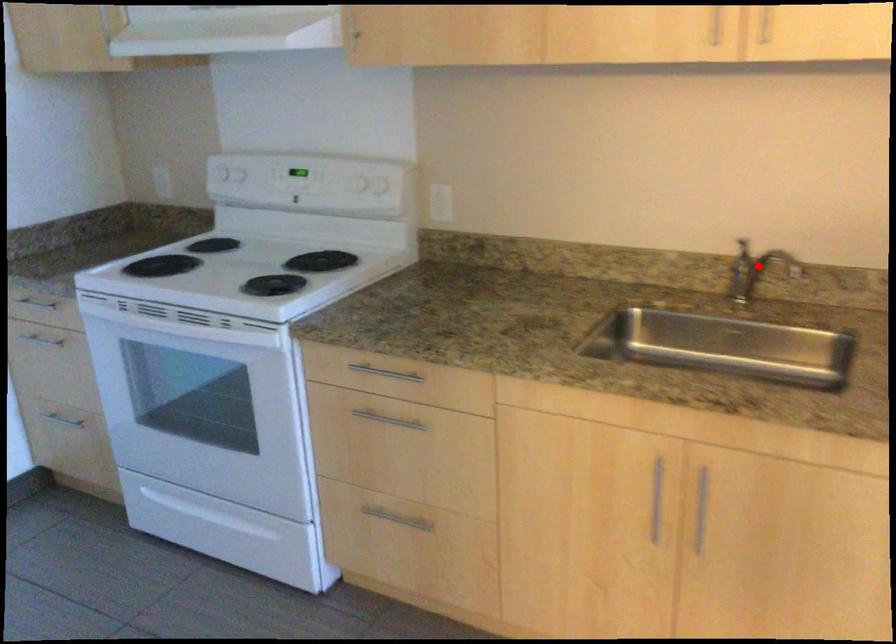
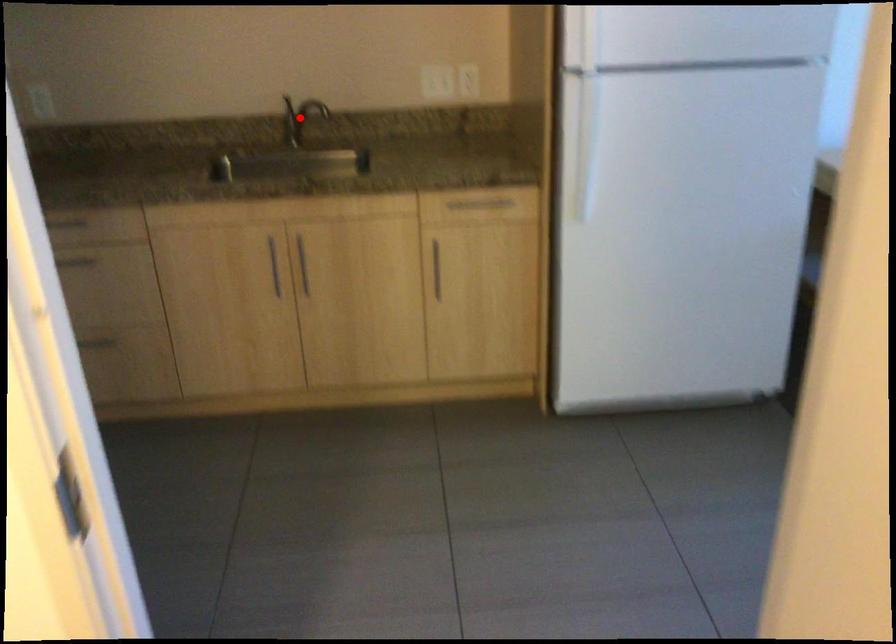
I am providing you with two images of the same scene from different viewpoints. A red point is marked on the first image and another point is marked on the second image. Is the red point in image1 aligned with the point shown in image2?

Yes